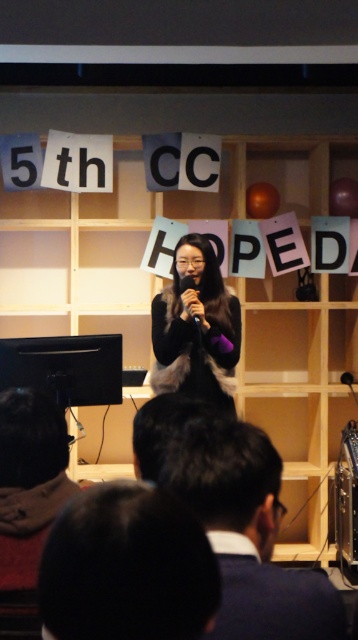
Question: Estimate the real-world distances between objects in this image. Which object is farther from the matte black microphone at center?

Choices:
 (A) wooden bookshelf at center
 (B) black hair at lower center

Answer: (B)

Question: Can you confirm if brown fuzzy jacket at lower left is positioned below matte black microphone at center?

Choices:
 (A) no
 (B) yes

Answer: (B)

Question: Which object is positioned farthest from the matte black microphone at center?

Choices:
 (A) brown fuzzy jacket at lower left
 (B) dark hair at center
 (C) wooden bookshelf at center
 (D) black matte fur coat at center

Answer: (B)

Question: Is black hair at lower center closer to camera compared to matte black microphone at center?

Choices:
 (A) yes
 (B) no

Answer: (A)

Question: Is wooden bookshelf at center behind brown fuzzy jacket at lower left?

Choices:
 (A) yes
 (B) no

Answer: (A)

Question: Among these objects, which one is nearest to the camera?

Choices:
 (A) black matte fur coat at center
 (B) matte black microphone at center
 (C) dark hair at center

Answer: (C)